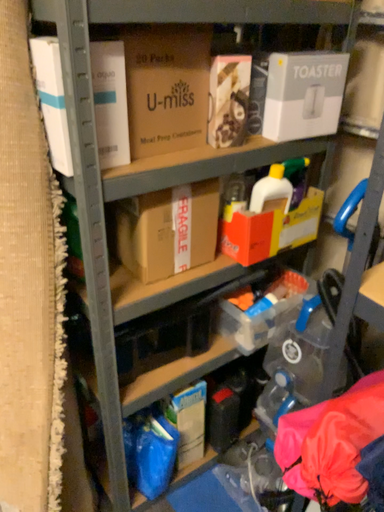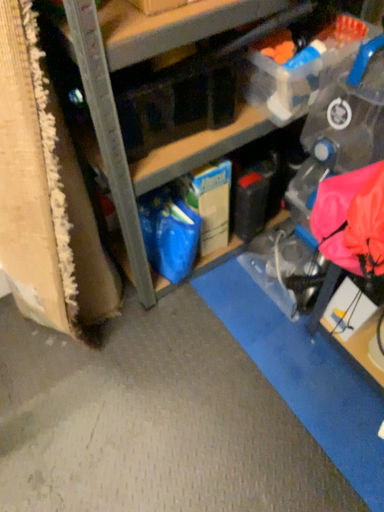
Question: How did the camera likely rotate when shooting the video?

Choices:
 (A) rotated upward
 (B) rotated downward

Answer: (B)